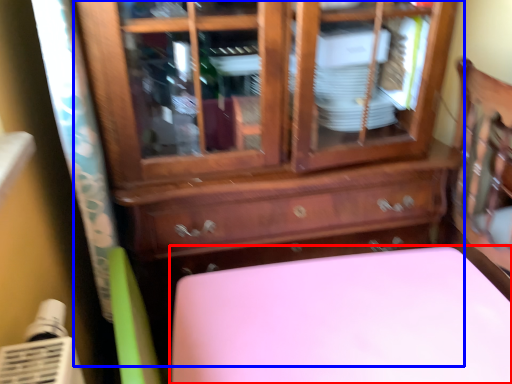
Question: Which of the following is the farthest to the observer, furniture (highlighted by a red box) or chest of drawers (highlighted by a blue box)?

Choices:
 (A) furniture
 (B) chest of drawers

Answer: (A)